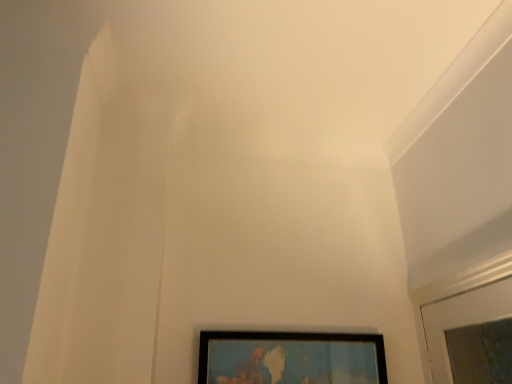
This screenshot has width=512, height=384. What are the coordinates of `wooden map frame at lower center` in the screenshot? It's located at (290, 358).

What is the approximate width of wooden map frame at lower center?

The width of wooden map frame at lower center is 2.02 inches.

This screenshot has height=384, width=512. What do you see at coordinates (290, 358) in the screenshot?
I see `wooden map frame at lower center` at bounding box center [290, 358].

This screenshot has width=512, height=384. What are the coordinates of `wooden map frame at lower center` in the screenshot? It's located at (290, 358).